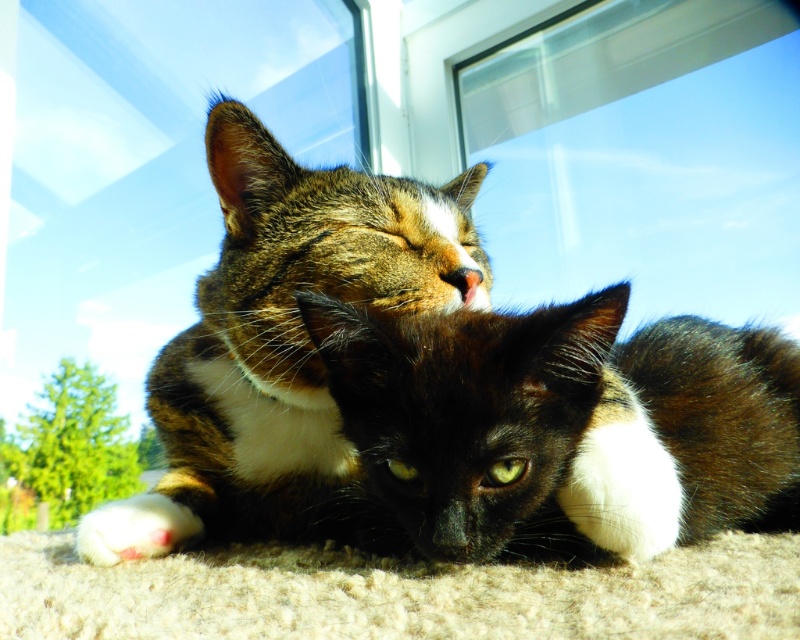
You are a photographer trying to capture both cats in the image. Since the calico fur cat at center and the black fur cat at center are positioned close to each other, which cat is located higher up in the frame?

The calico fur cat at center is positioned above the black fur cat at center, so it is higher up in the frame.

You are standing in front of the two cats on the textured surface. You want to toss a treat to the cat that is closer to you. Which point should you aim for, point (784, 465) or point (118, 353)?

You should aim for point (784, 465) because it is closer to you than point (118, 353).

You are a photographer trying to capture both cats in a single frame. Given that the calico fur cat at center and the black fur cat at center are both at the center, which cat would you need to adjust your focus on to ensure the larger one is in sharp focus?

The calico fur cat at center is bigger than the black fur cat at center, so you should focus on the calico fur cat at center to ensure the larger one is in sharp focus.